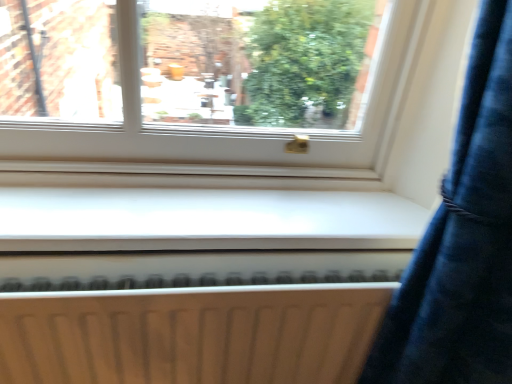
Question: Considering the positions of white matte radiator at lower center and white smooth window sill at center in the image, is white matte radiator at lower center wider or thinner than white smooth window sill at center?

Choices:
 (A) wide
 (B) thin

Answer: (B)

Question: Is white matte radiator at lower center taller or shorter than white smooth window sill at center?

Choices:
 (A) tall
 (B) short

Answer: (A)

Question: Considering their positions, is white matte radiator at lower center located in front of or behind white smooth window sill at center?

Choices:
 (A) front
 (B) behind

Answer: (A)

Question: Choose the correct answer: Is white smooth window sill at center inside white matte radiator at lower center or outside it?

Choices:
 (A) inside
 (B) outside

Answer: (B)

Question: Is point (31, 226) positioned closer to the camera than point (122, 322)?

Choices:
 (A) farther
 (B) closer

Answer: (B)

Question: In terms of size, does white smooth window sill at center appear bigger or smaller than white matte radiator at lower center?

Choices:
 (A) small
 (B) big

Answer: (A)

Question: From a real-world perspective, is white smooth window sill at center physically located above or below white matte radiator at lower center?

Choices:
 (A) below
 (B) above

Answer: (B)